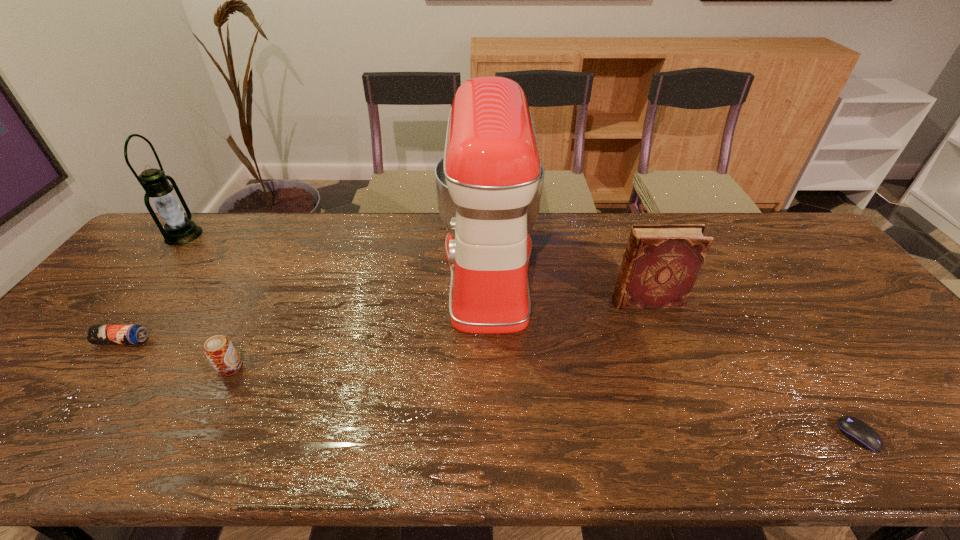
The width and height of the screenshot is (960, 540). I want to click on the nearest object, so click(856, 430).

Find the location of a particular element. The image size is (960, 540). vacant space located on the front-facing side of the mixer is located at coordinates point(332,271).

Identify the location of vacant area situated 0.140m on the front-facing side of the mixer. The height and width of the screenshot is (540, 960). (392, 271).

At what (x,y) coordinates should I click in order to perform the action: click on vacant region located on the front-facing side of the mixer. Please return your answer as a coordinate pair (x, y). Image resolution: width=960 pixels, height=540 pixels. Looking at the image, I should click on (389, 271).

This screenshot has height=540, width=960. Identify the location of free region located 0.220m on the side where the fifth shortest object emits light. (267, 235).

Find the location of a particular element. vacant space located on the spine side of the hardback book is located at coordinates (512, 301).

At what (x,y) coordinates should I click in order to perform the action: click on vacant space situated on the spine side of the hardback book. Please return your answer as a coordinate pair (x, y). This screenshot has width=960, height=540. Looking at the image, I should click on (559, 301).

Find the location of a particular element. blank space located on the spine side of the hardback book is located at coordinates (505, 301).

Find the location of a particular element. The width and height of the screenshot is (960, 540). vacant space located 0.130m on the right of the fourth tallest object is located at coordinates (296, 368).

You are a GUI agent. You are given a task and a screenshot of the screen. Output one action in this format:
    pyautogui.click(x=<x>, y=<y>)
    Task: Click on the vacant space located on the back of the farther beer can
    
    Given the screenshot: What is the action you would take?
    pyautogui.click(x=174, y=275)